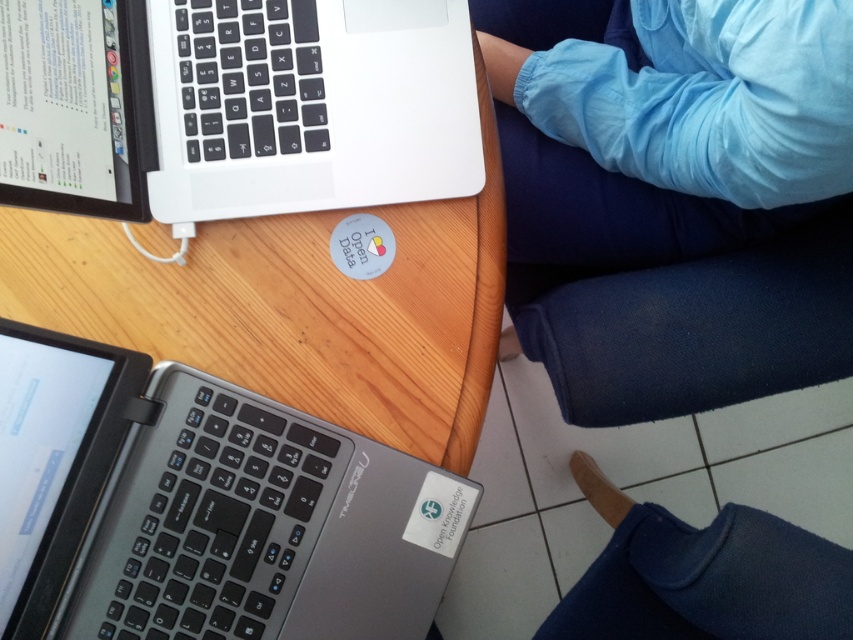
Question: Is blue fabric pants at lower right positioned before silver metallic laptop at lower left?

Choices:
 (A) no
 (B) yes

Answer: (B)

Question: Among these points, which one is nearest to the camera?

Choices:
 (A) (584, 602)
 (B) (384, 602)

Answer: (B)

Question: Which of the following is the farthest from the observer?

Choices:
 (A) (843, 628)
 (B) (523, 122)

Answer: (B)

Question: Is blue fabric pants at lower right to the left of blue fabric leg at lower right from the viewer's perspective?

Choices:
 (A) no
 (B) yes

Answer: (B)

Question: Can you confirm if blue fabric pants at lower right is positioned above blue fabric leg at lower right?

Choices:
 (A) no
 (B) yes

Answer: (B)

Question: Among these points, which one is nearest to the camera?

Choices:
 (A) (720, 264)
 (B) (828, 637)

Answer: (B)